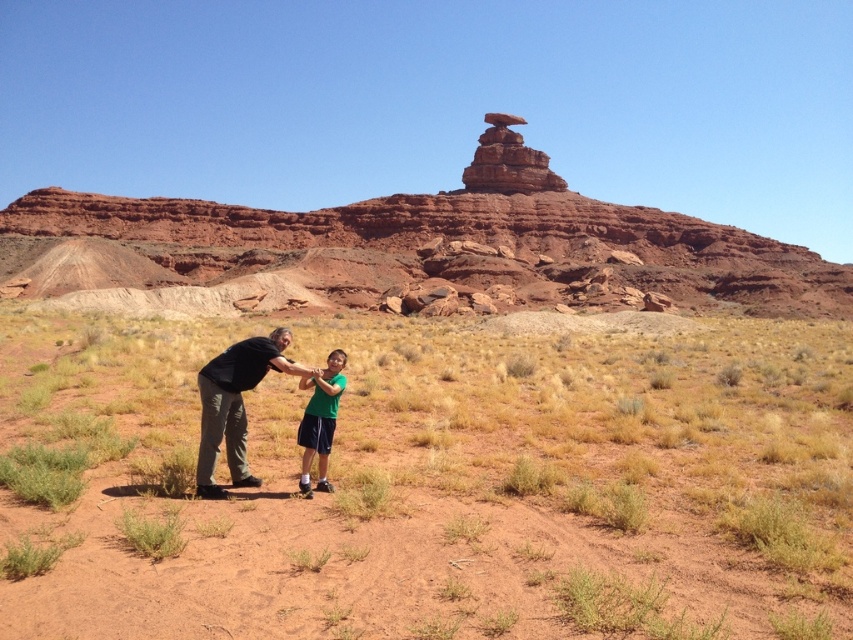
You are standing at the origin point of the coordinate system in this desert scene. You want to walk to the Mexican Hat Rock in the background. Which direction should you move relative to the brown dirt at center?

The Mexican Hat Rock is in the background, so you should move away from the brown dirt at center towards the direction where the background is located. Since the brown dirt at center is at point [433,484], moving towards the background would mean increasing the y coordinate. Therefore, you should move upwards from the brown dirt at center.

You are a photographer trying to capture a photo of the Mexican Hat Rock in the background. You need to ensure that both the brown dirt at center and the green matte shirt at center are visible in the frame. Which object should you focus on first to make sure they are both in focus?

The brown dirt at center is taller than the green matte shirt at center, so you should focus on the brown dirt at center first to ensure both are in focus.

You are standing at the origin point in the desert scene. There is a dark gray pants at center located at point (235, 404). If you want to walk directly to the dark gray pants at center, in which direction should you head?

You should head towards the point (235, 404) to reach the dark gray pants at center.